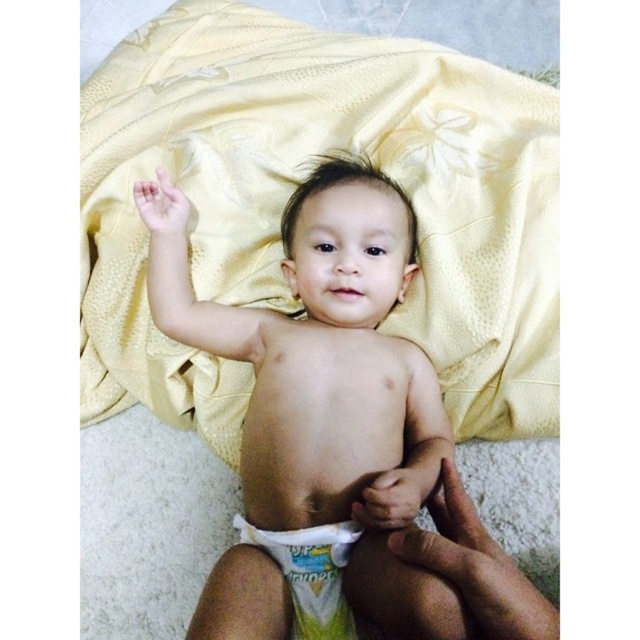
Question: Among these objects, which one is nearest to the camera?

Choices:
 (A) yellow satin blanket at upper center
 (B) white cloth diaper at center

Answer: (B)

Question: Which point is farther to the camera?

Choices:
 (A) white cloth diaper at center
 (B) yellow satin blanket at upper center

Answer: (B)

Question: Based on their relative distances, which object is nearer to the white cloth diaper at center?

Choices:
 (A) skinny white diaper at lower center
 (B) smooth skin baby at center
 (C) yellow satin blanket at upper center

Answer: (A)

Question: Is skinny white diaper at lower center closer to the viewer compared to white cloth diaper at center?

Choices:
 (A) yes
 (B) no

Answer: (A)

Question: Is yellow satin blanket at upper center smaller than skinny white diaper at lower center?

Choices:
 (A) no
 (B) yes

Answer: (A)

Question: Can you confirm if smooth skin baby at center is thinner than white cloth diaper at center?

Choices:
 (A) yes
 (B) no

Answer: (B)